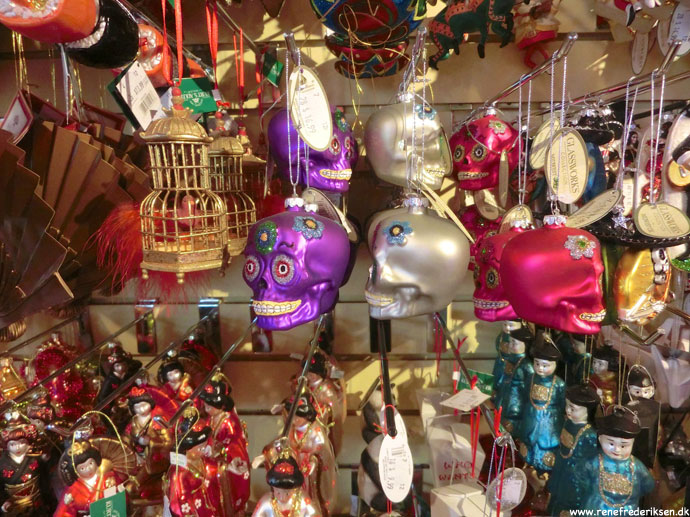
You are a GUI agent. You are given a task and a screenshot of the screen. Output one action in this format:
    pyautogui.click(x=<x>, y=<y>)
    Task: Click on the background beige wall with hook receptacles
    
    Given the screenshot: What is the action you would take?
    pyautogui.click(x=232, y=285)